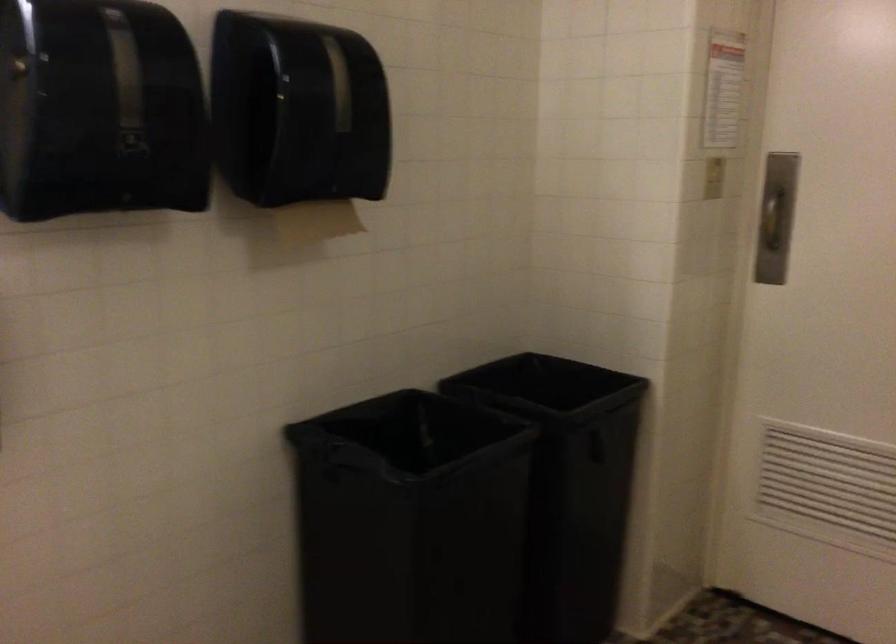
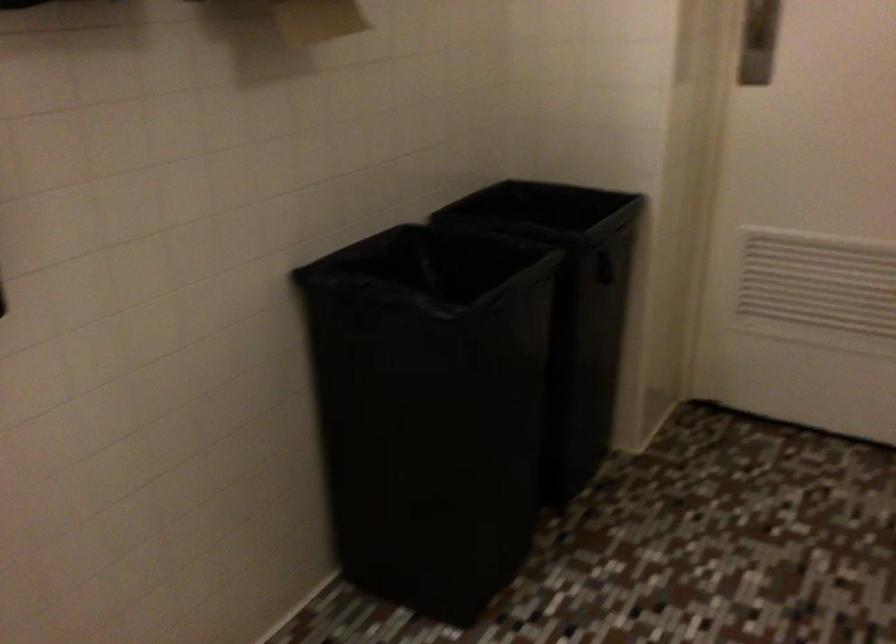
In a continuous first-person perspective shot, in which direction is the camera moving?

The cameraman moved toward left, forward.